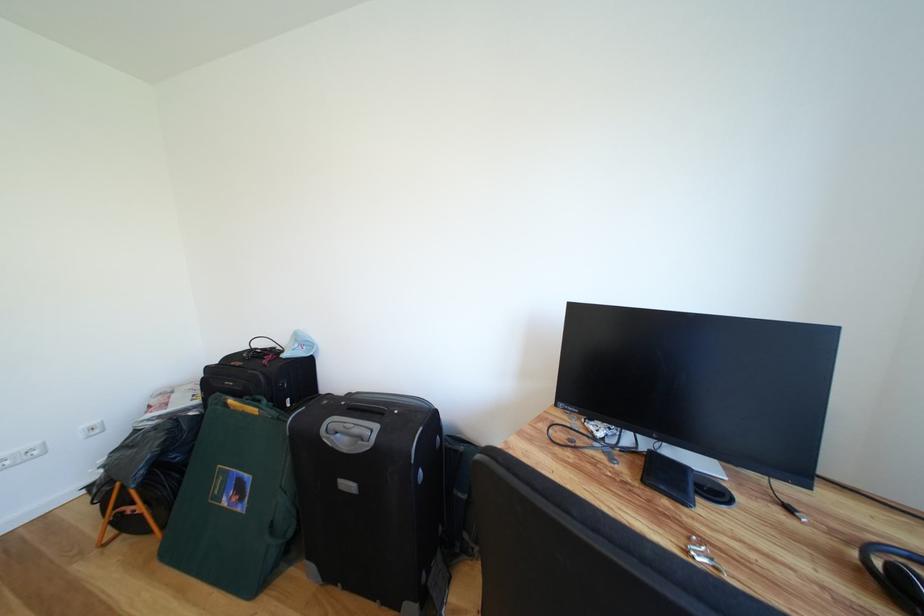
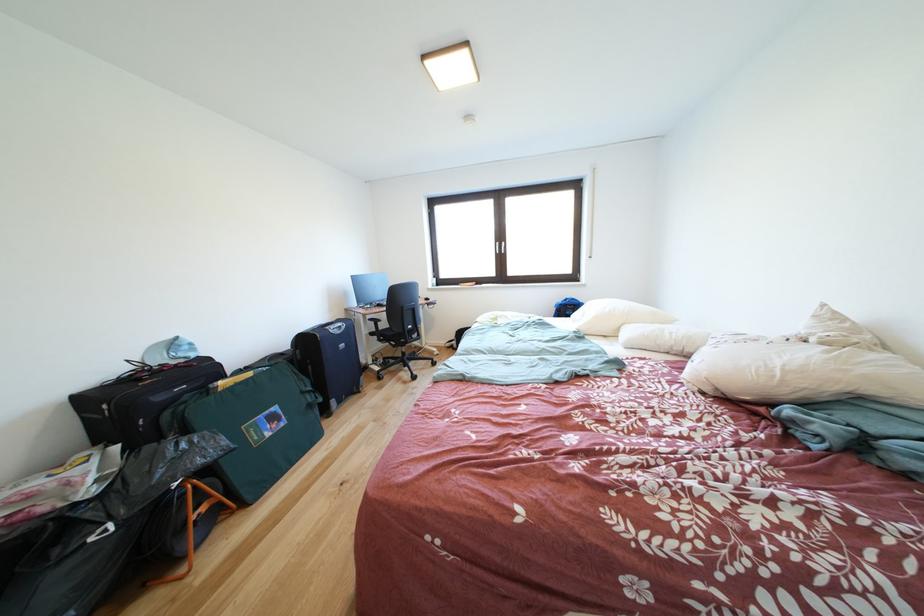
Locate, in the second image, the point that corresponds to the point at 353,455 in the first image.

(347, 337)